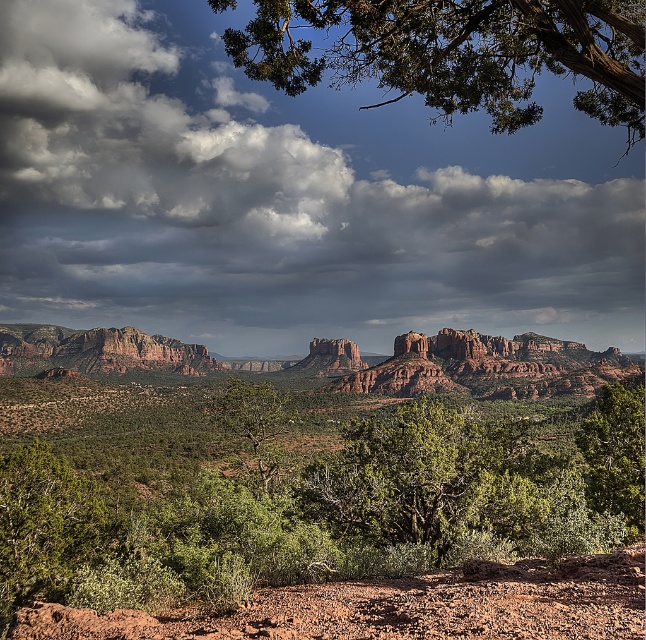
Between green leafy tree at upper center and rustic sandstone mountain at left, which one is positioned higher?

Positioned higher is green leafy tree at upper center.

Based on the photo, is green leafy tree at upper center to the right of rustic sandstone mountain at left from the viewer's perspective?

Indeed, green leafy tree at upper center is positioned on the right side of rustic sandstone mountain at left.

At what (x,y) coordinates should I click in order to perform the action: click on green leafy tree at upper center. Please return your answer as a coordinate pair (x, y). This screenshot has width=646, height=640. Looking at the image, I should click on (455, 52).

Find the location of a particular element. cloudy sky at upper center is located at coordinates (289, 196).

Is point (253, 104) closer to camera compared to point (76, 353)?

No, (253, 104) is further to viewer.

Image resolution: width=646 pixels, height=640 pixels. I want to click on cloudy sky at upper center, so click(289, 196).

Is green leafy shrubs at center shorter than green leafy tree at center?

In fact, green leafy shrubs at center may be taller than green leafy tree at center.

Which is behind, point (479, 576) or point (256, 444)?

Point (256, 444)

The image size is (646, 640). In order to click on green leafy shrubs at center in this screenshot , I will do `click(306, 513)`.